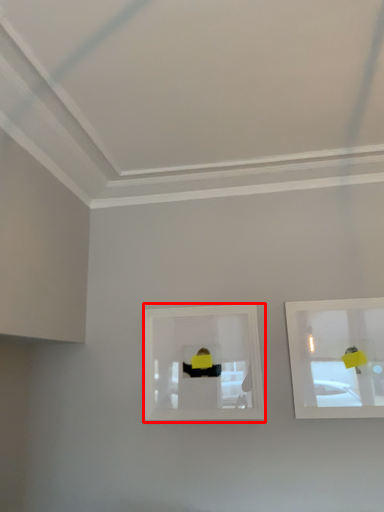
Question: From the image's perspective, what is the correct spatial relationship of picture frame (annotated by the red box) in relation to picture frame?

Choices:
 (A) below
 (B) above

Answer: (A)